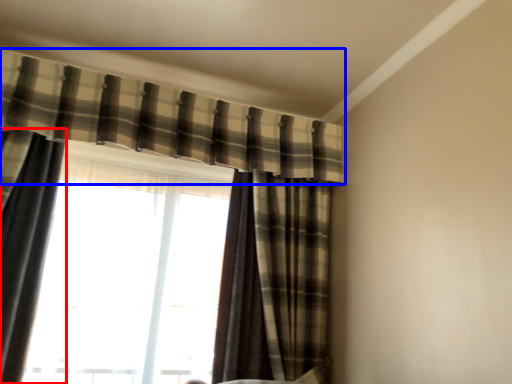
Question: Which object is further to the camera taking this photo, curtain (highlighted by a red box) or curtain (highlighted by a blue box)?

Choices:
 (A) curtain
 (B) curtain

Answer: (B)